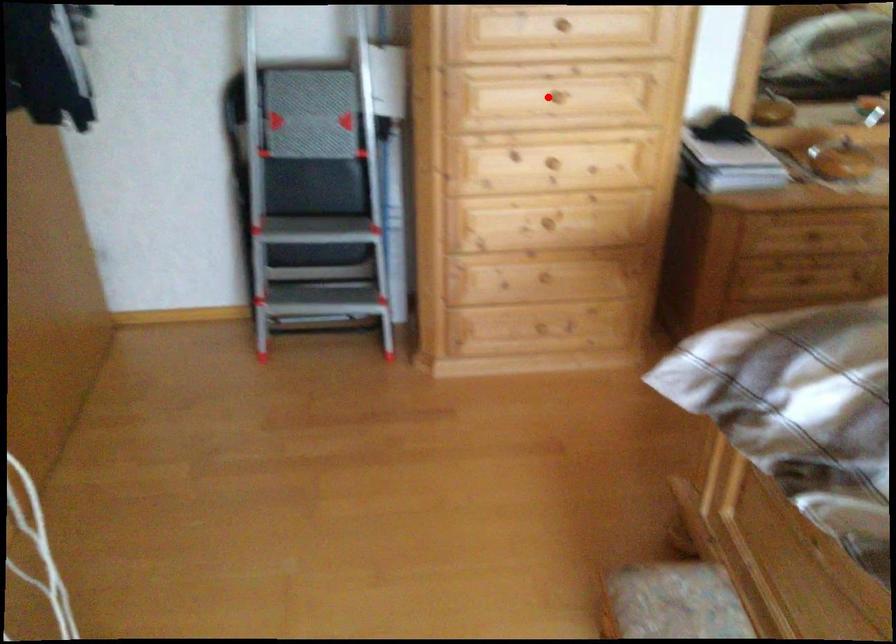
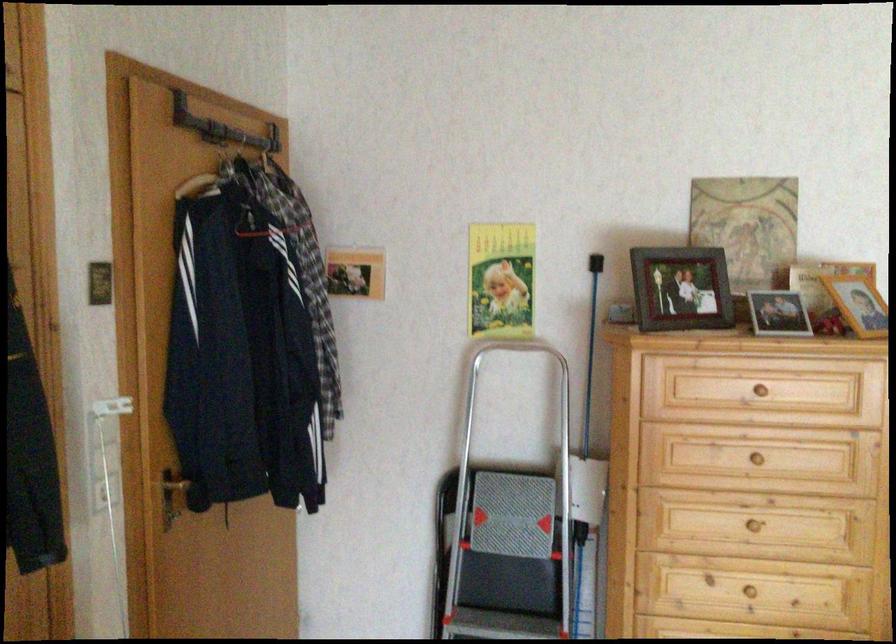
In the second image, find the point that corresponds to the highlighted location in the first image.

(754, 526)